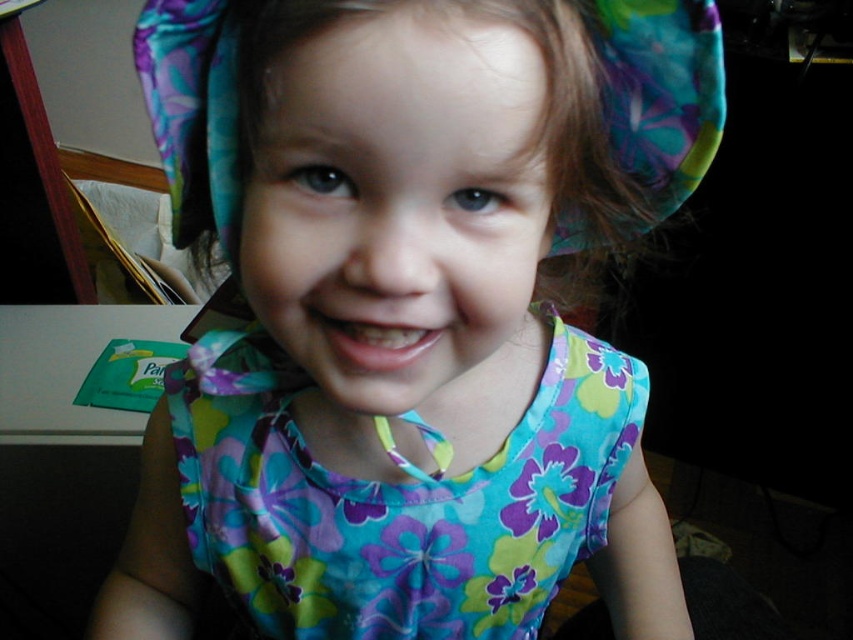
Which is more to the left, floral fabric head at center or floral fabric hat at upper center?

From the viewer's perspective, floral fabric hat at upper center appears more on the left side.

Describe the element at coordinates (405, 180) in the screenshot. I see `floral fabric head at center` at that location.

Who is more forward, (265,77) or (666,128)?

Point (265,77) is in front.

Find the location of `floral fabric head at center`. floral fabric head at center is located at coordinates (405, 180).

Does floral fabric dress at center appear on the left side of floral fabric head at center?

Yes, floral fabric dress at center is to the left of floral fabric head at center.

Which is more to the right, floral fabric dress at center or floral fabric head at center?

floral fabric head at center

Does point (592, 400) come behind point (279, 260)?

Yes, it is.

Locate an element on the screen. This screenshot has height=640, width=853. floral fabric dress at center is located at coordinates (410, 312).

Between floral fabric head at center and floral cotton dress at center, which one appears on the right side from the viewer's perspective?

floral fabric head at center is more to the right.

Who is lower down, floral fabric head at center or floral cotton dress at center?

floral cotton dress at center is lower down.

Is point (366, 128) positioned behind point (473, 608)?

No, it is not.

Identify the location of floral fabric head at center. The height and width of the screenshot is (640, 853). (405, 180).